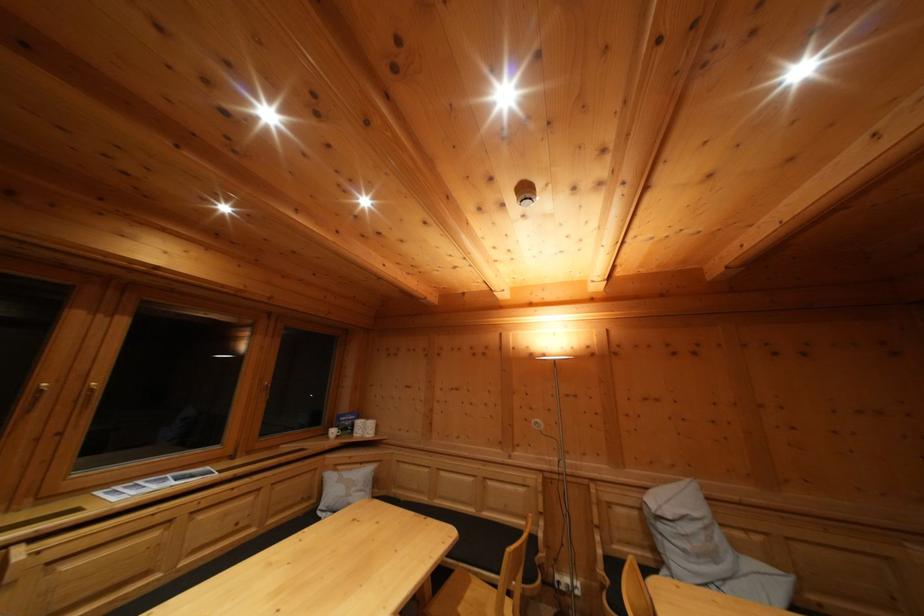
Where would you plugging in the white electrical outlet? Please return your answer as a coordinate pair (x, y).

(565, 582)